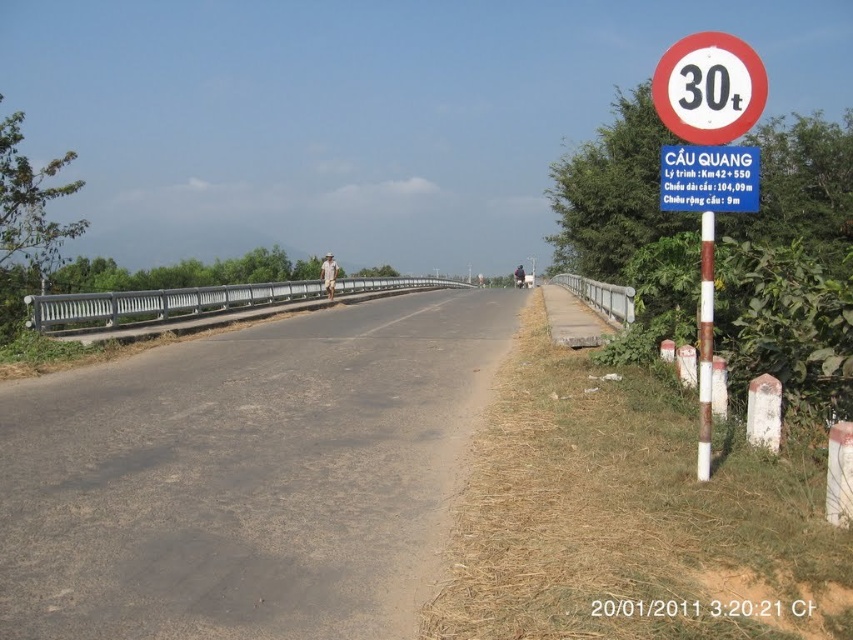
Is white plastic speed limit sign at upper right positioned before white plastic sign at upper right?

Yes, it is.

Can you confirm if white plastic speed limit sign at upper right is smaller than white plastic sign at upper right?

Incorrect, white plastic speed limit sign at upper right is not smaller in size than white plastic sign at upper right.

Where is `white plastic speed limit sign at upper right`? This screenshot has height=640, width=853. white plastic speed limit sign at upper right is located at coordinates (709, 88).

Does white plastic sign at right appear on the right side of silver metallic bridge at center?

Indeed, white plastic sign at right is positioned on the right side of silver metallic bridge at center.

Which is in front, point (757, 68) or point (339, 289)?

Point (757, 68) is in front.

The image size is (853, 640). What are the coordinates of `white plastic sign at right` in the screenshot? It's located at (709, 92).

Can you confirm if black asphalt highway at center is positioned below silver metallic bridge at center?

Yes, black asphalt highway at center is below silver metallic bridge at center.

Between black asphalt highway at center and silver metallic bridge at center, which one is positioned higher?

silver metallic bridge at center

I want to click on black asphalt highway at center, so click(x=247, y=476).